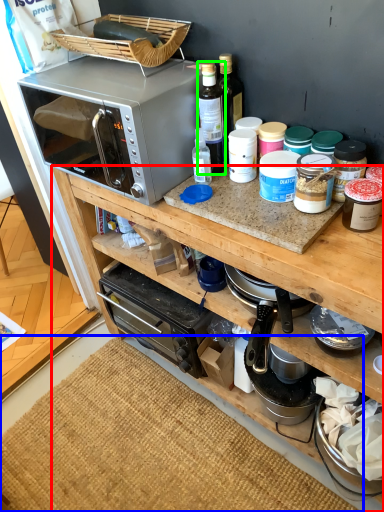
Question: Considering the real-world distances, which object is farthest from cabinetry (highlighted by a red box)? mat (highlighted by a blue box) or bottle (highlighted by a green box)?

Choices:
 (A) mat
 (B) bottle

Answer: (A)